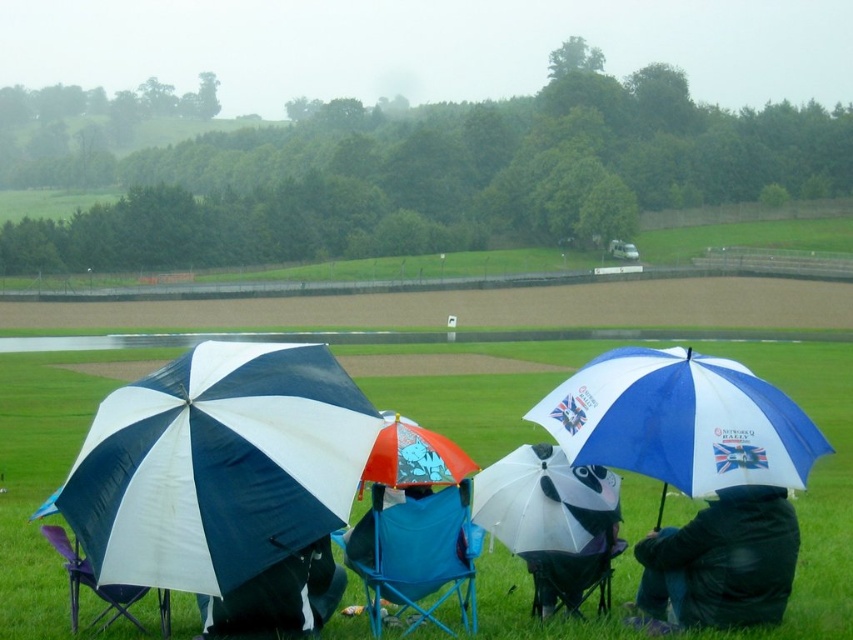
You are standing at the center of the image and see the blue and white fabric umbrella at center right and the dark blue jacket at lower right. Which object is positioned to the left?

The dark blue jacket at lower right is positioned to the left of the blue and white fabric umbrella at center right.